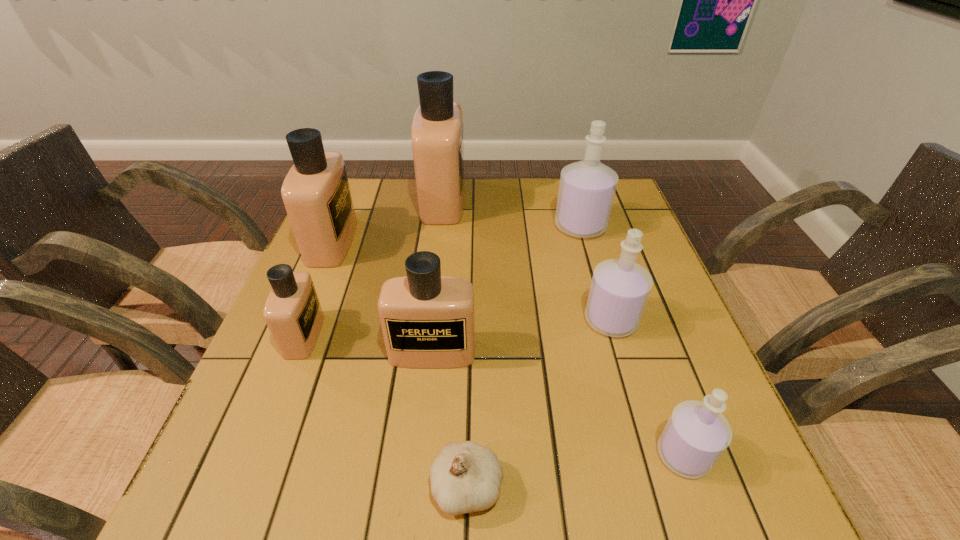
At what (x,y) coordinates should I click in order to perform the action: click on vacant space situated 0.080m on the front label of the tallest perfume. Please return your answer as a coordinate pair (x, y). This screenshot has height=540, width=960. Looking at the image, I should click on (492, 200).

Identify the location of free space located on the front label of the third smallest beige perfume. (446, 242).

Locate an element on the screen. free space located 0.050m on the right of the biggest purple perfume is located at coordinates (624, 226).

Locate an element on the screen. The height and width of the screenshot is (540, 960). free location located on the front of the second farthest purple perfume is located at coordinates (670, 520).

Find the location of `free space located 0.130m on the front label of the second smallest beige perfume`. free space located 0.130m on the front label of the second smallest beige perfume is located at coordinates (424, 430).

Where is `blank space located on the front label of the smallest beige perfume`? The image size is (960, 540). blank space located on the front label of the smallest beige perfume is located at coordinates (498, 335).

At what (x,y) coordinates should I click in order to perform the action: click on vacant space situated on the left of the nearest purple perfume. Please return your answer as a coordinate pair (x, y). The height and width of the screenshot is (540, 960). Looking at the image, I should click on (615, 455).

Locate an element on the screen. This screenshot has height=540, width=960. free space located on the right of the shortest object is located at coordinates (585, 487).

Where is `perfume at the near edge`? perfume at the near edge is located at coordinates (696, 435).

At what (x,y) coordinates should I click in order to perform the action: click on garlic at the near edge. Please return your answer as a coordinate pair (x, y). The width and height of the screenshot is (960, 540). Looking at the image, I should click on (466, 477).